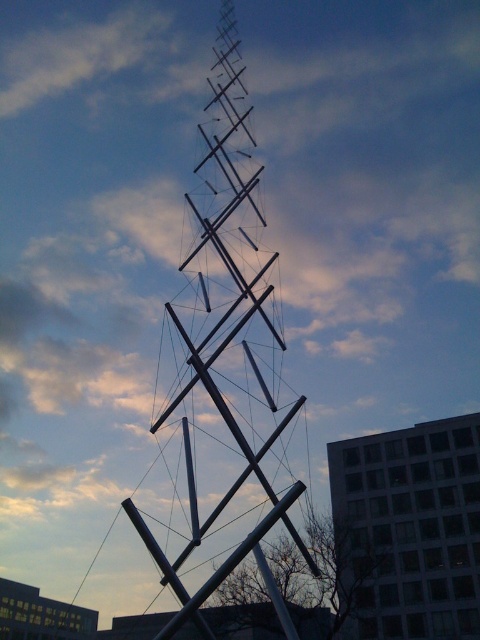
Question: Which object is closer to the camera taking this photo?

Choices:
 (A) white glass building at center
 (B) silver metallic spire at center

Answer: (B)

Question: Considering the relative positions of silver metallic spire at center and white glass building at center in the image provided, where is silver metallic spire at center located with respect to white glass building at center?

Choices:
 (A) below
 (B) above

Answer: (B)

Question: Among these objects, which one is nearest to the camera?

Choices:
 (A) white glass building at center
 (B) silver metallic spire at center

Answer: (B)

Question: Does silver metallic spire at center have a lesser width compared to white glass building at center?

Choices:
 (A) yes
 (B) no

Answer: (B)

Question: Observing the image, what is the correct spatial positioning of silver metallic spire at center in reference to white glass building at center?

Choices:
 (A) right
 (B) left

Answer: (B)

Question: Which of the following is the farthest from the observer?

Choices:
 (A) silver metallic spire at center
 (B) white glass building at center

Answer: (B)